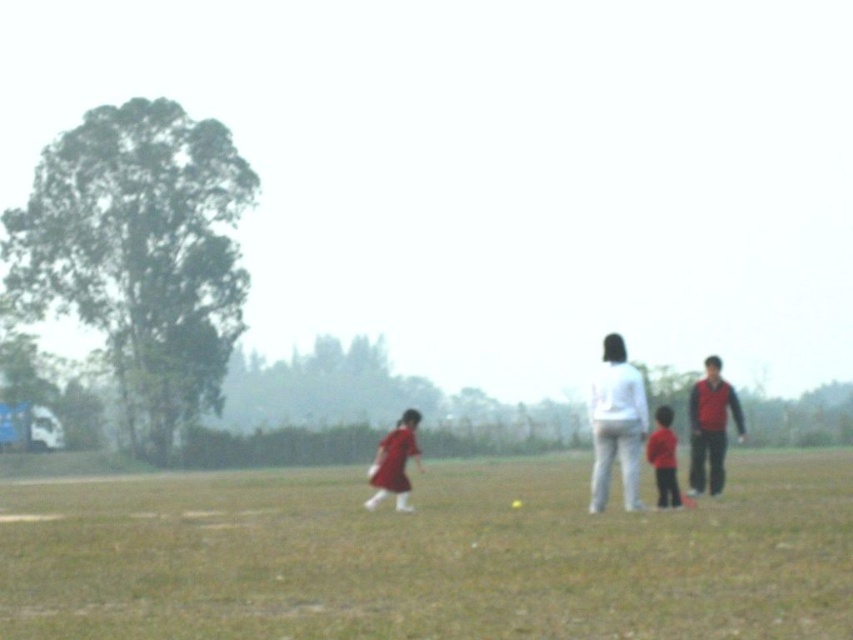
Question: Which point is closer to the camera?

Choices:
 (A) red fabric jacket at right
 (B) white matte pants at center

Answer: (B)

Question: Which point is closer to the camera?

Choices:
 (A) (593, 380)
 (B) (665, 408)

Answer: (A)

Question: Does green grassy field at center have a lesser width compared to white matte pants at center?

Choices:
 (A) no
 (B) yes

Answer: (A)

Question: Which is nearer to the green grassy field at center?

Choices:
 (A) matte red dress at center
 (B) matte red shirt at center
 (C) white matte pants at center

Answer: (C)

Question: Observing the image, what is the correct spatial positioning of red fabric jacket at right in reference to matte red dress at center?

Choices:
 (A) left
 (B) right

Answer: (B)

Question: Does white cotton pants at right have a greater width compared to matte red dress at center?

Choices:
 (A) no
 (B) yes

Answer: (B)